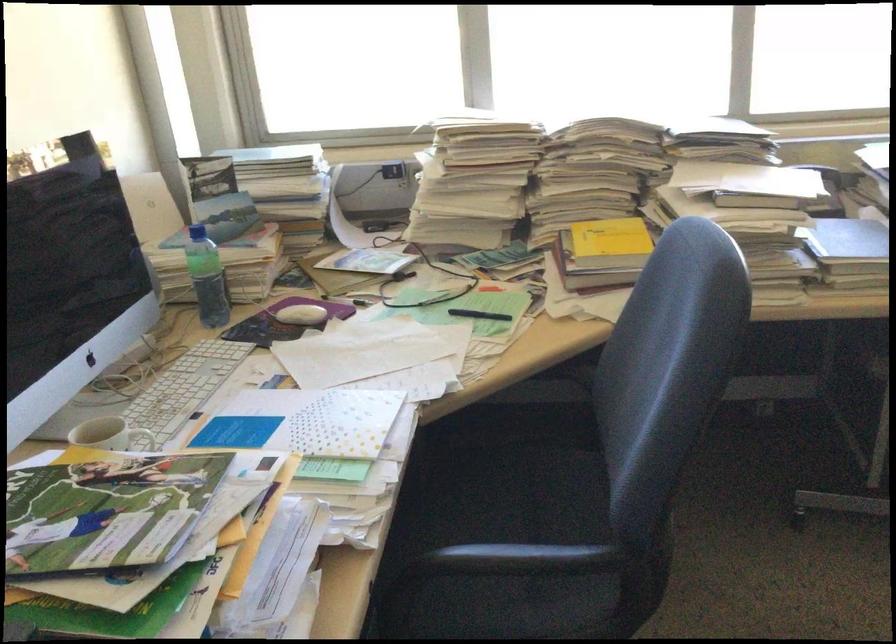
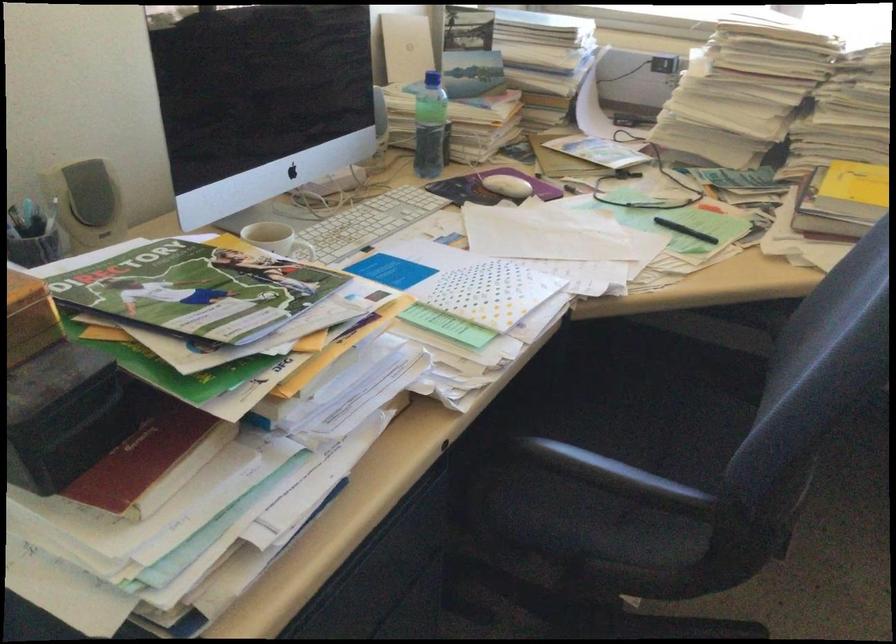
The point at [208,279] is marked in the first image. Where is the corresponding point in the second image?

(428, 126)